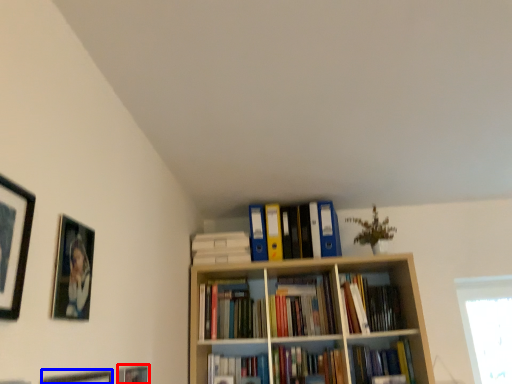
Question: Which object appears closest to the camera in this image, picture frame (highlighted by a red box) or picture frame (highlighted by a blue box)?

Choices:
 (A) picture frame
 (B) picture frame

Answer: (B)